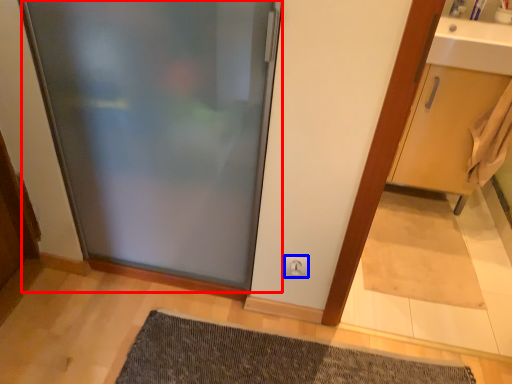
Question: Which of the following is the farthest to the observer, door (highlighted by a red box) or electric outlet (highlighted by a blue box)?

Choices:
 (A) door
 (B) electric outlet

Answer: (B)